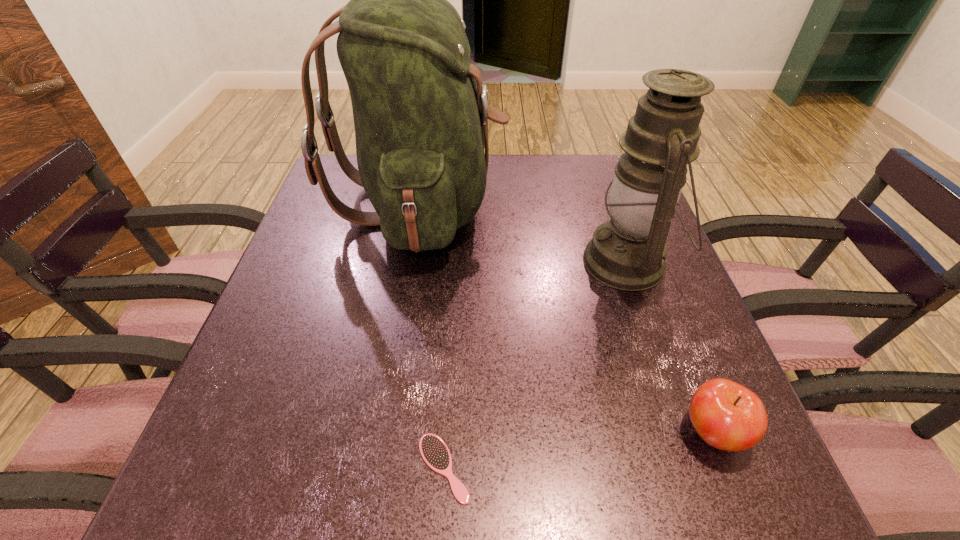
Where is `hairbrush that is at the near edge`? Image resolution: width=960 pixels, height=540 pixels. hairbrush that is at the near edge is located at coordinates (434, 451).

Find the location of `object that is positioned at the left edge`. object that is positioned at the left edge is located at coordinates (420, 110).

The width and height of the screenshot is (960, 540). In order to click on oil lamp that is at the right edge in this screenshot , I will do `click(628, 252)`.

This screenshot has height=540, width=960. Identify the location of apple that is at the right edge. (726, 415).

Where is `object positioned at the far left corner`? object positioned at the far left corner is located at coordinates (420, 110).

The image size is (960, 540). Find the location of `object that is at the near right corner`. object that is at the near right corner is located at coordinates (726, 415).

The height and width of the screenshot is (540, 960). Find the location of `vacant space at the far edge of the desktop`. vacant space at the far edge of the desktop is located at coordinates (577, 194).

Identify the location of vacant space at the left edge of the desktop. (292, 313).

In the image, there is a desktop. Identify the location of vacant space at the right edge. The image size is (960, 540). (660, 283).

You are a GUI agent. You are given a task and a screenshot of the screen. Output one action in this format:
    pyautogui.click(x=<x>, y=<y>)
    Task: Click on the free space at the far right corner of the desktop
    
    Given the screenshot: What is the action you would take?
    pyautogui.click(x=591, y=184)